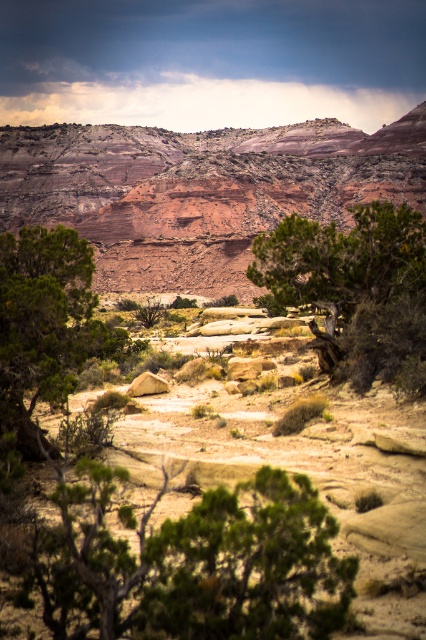
Question: Estimate the real-world distances between objects in this image. Which object is farther from the green leafy tree at center?

Choices:
 (A) rustic sandstone mountain at center
 (B) green matte tree at left

Answer: (A)

Question: Which object is farther from the camera taking this photo?

Choices:
 (A) rustic sandstone mountain at center
 (B) green matte tree at left
 (C) green leafy tree at center

Answer: (A)

Question: Is rustic sandstone mountain at center smaller than green leafy tree at center?

Choices:
 (A) no
 (B) yes

Answer: (A)

Question: Can you confirm if rustic sandstone mountain at center is positioned to the left of green matte tree at left?

Choices:
 (A) no
 (B) yes

Answer: (A)

Question: Among these points, which one is farthest from the camera?

Choices:
 (A) (57, 252)
 (B) (334, 240)

Answer: (B)

Question: Where is green leafy tree at center located in relation to green matte tree at left in the image?

Choices:
 (A) above
 (B) below

Answer: (A)